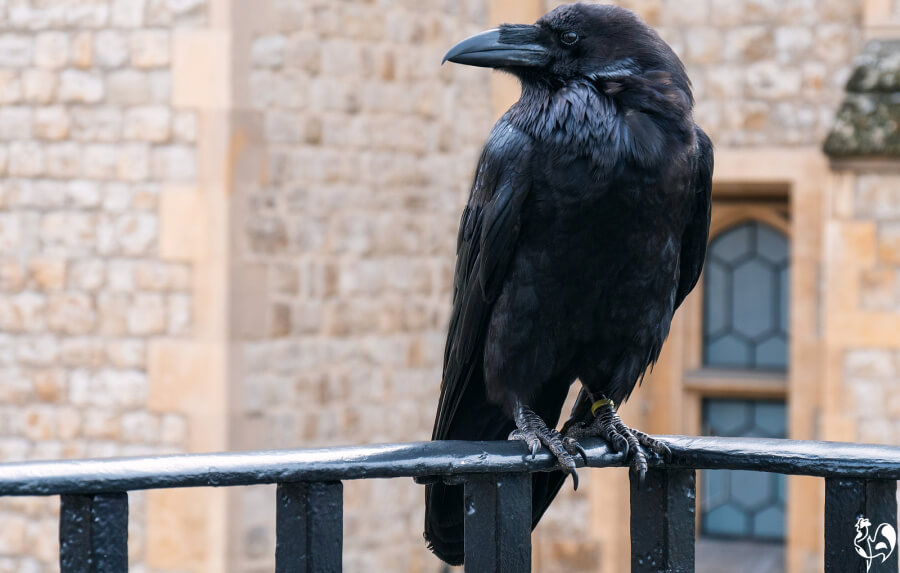
In order to click on window in this screenshot , I will do `click(761, 293)`, `click(765, 410)`.